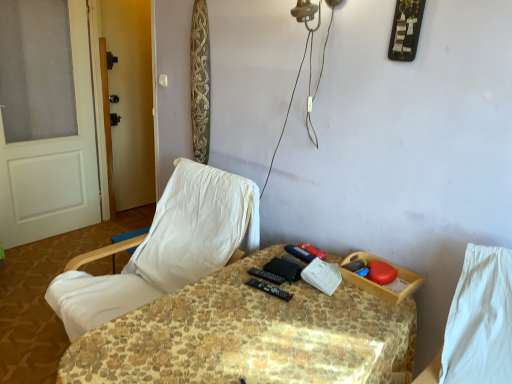
Where is `vacant point to the left of black plastic remote control at center`? vacant point to the left of black plastic remote control at center is located at coordinates (228, 291).